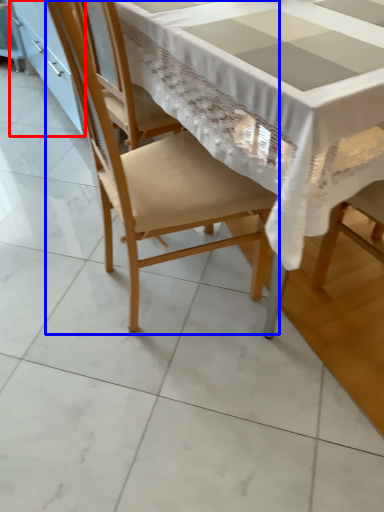
Question: Which of the following is the farthest to the observer, cabinetry (highlighted by a red box) or chair (highlighted by a blue box)?

Choices:
 (A) cabinetry
 (B) chair

Answer: (A)